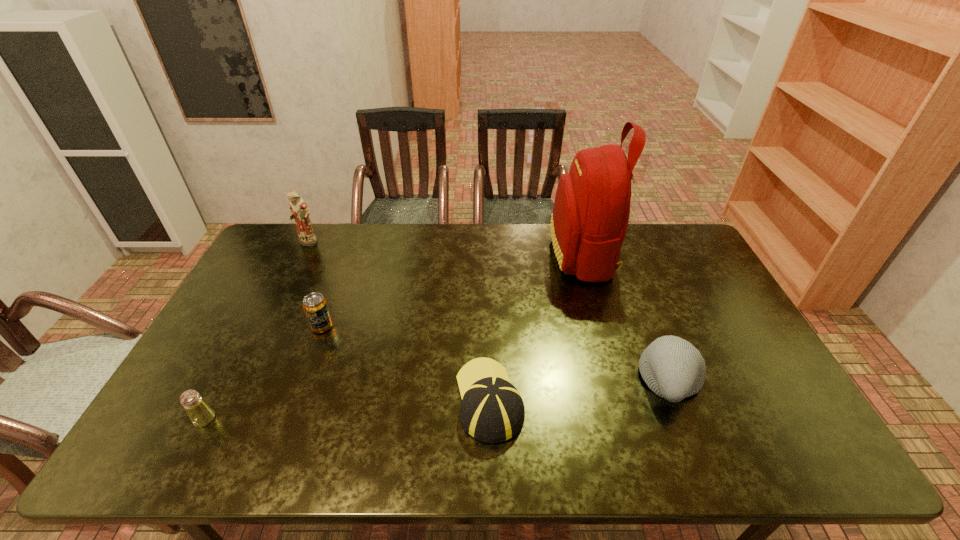
Find the location of a particular element. The height and width of the screenshot is (540, 960). figurine present at the left edge is located at coordinates (299, 210).

Locate an element on the screen. This screenshot has width=960, height=540. saltshaker at the left edge is located at coordinates (200, 413).

Where is `object that is at the far left corner`? The image size is (960, 540). object that is at the far left corner is located at coordinates (299, 210).

Where is `vacant space at the far edge of the desktop`? vacant space at the far edge of the desktop is located at coordinates (444, 233).

In the image, there is a desktop. At what (x,y) coordinates should I click in order to perform the action: click on free space at the near edge. Please return your answer as a coordinate pair (x, y). Looking at the image, I should click on (442, 430).

The image size is (960, 540). Identify the location of free space at the left edge of the desktop. (270, 321).

At what (x,y) coordinates should I click in order to perform the action: click on vacant space at the right edge of the desktop. Please return your answer as a coordinate pair (x, y). Looking at the image, I should click on (683, 312).

Where is `blank space at the far left corner of the desktop`? blank space at the far left corner of the desktop is located at coordinates (278, 229).

In the image, there is a desktop. Where is `vacant region at the near left corner`? This screenshot has width=960, height=540. vacant region at the near left corner is located at coordinates (200, 434).

Locate an element on the screen. free space between the beanie and the baseball cap is located at coordinates (581, 390).